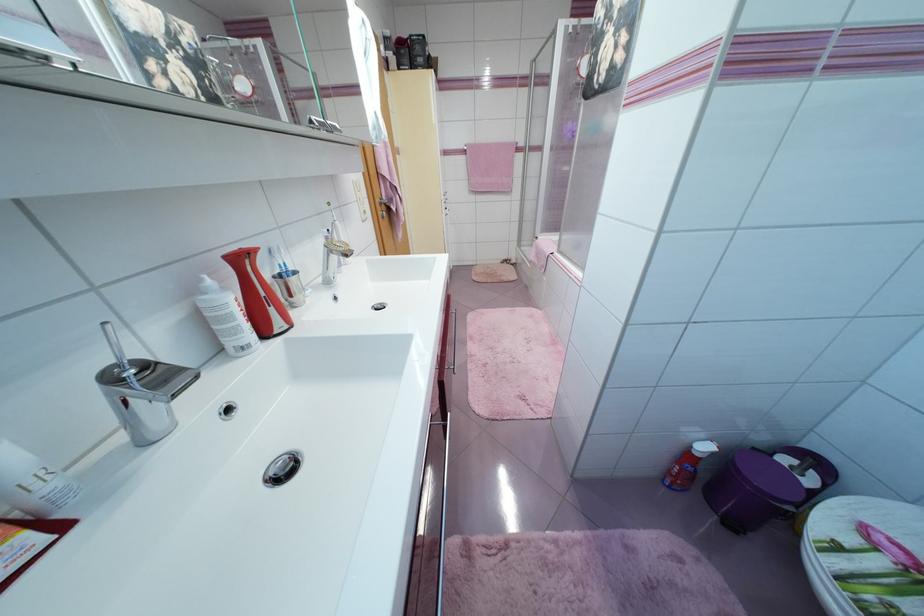
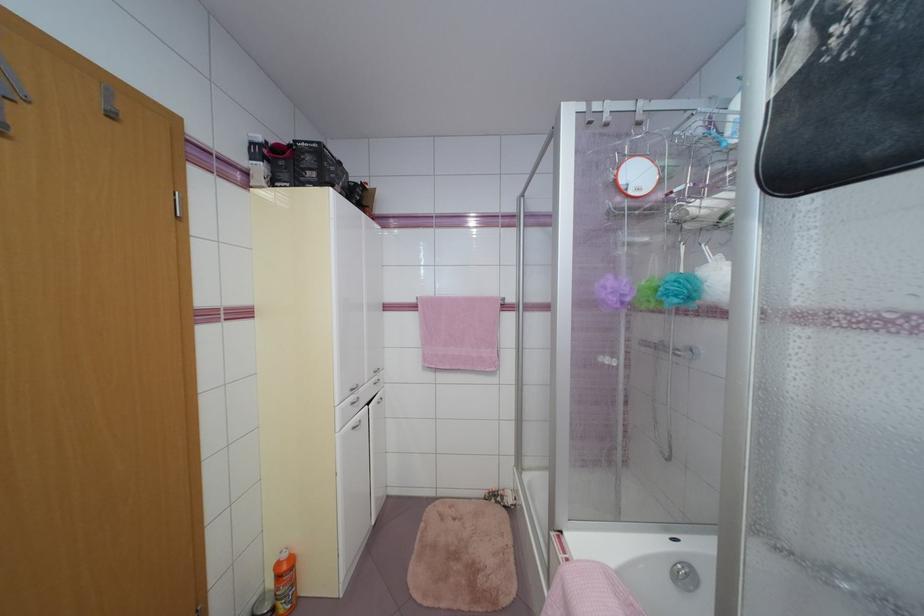
The point at (477, 172) is marked in the first image. Where is the corresponding point in the second image?

(433, 336)